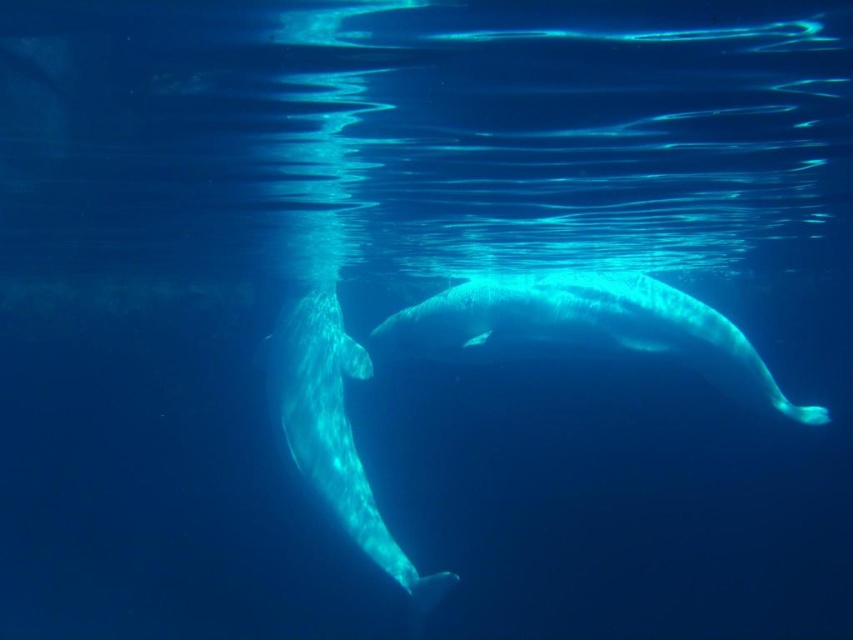
Question: Does translucent blue whale at center have a smaller size compared to translucent blue dolphin at center?

Choices:
 (A) no
 (B) yes

Answer: (B)

Question: Is translucent blue whale at center positioned in front of translucent blue dolphin at center?

Choices:
 (A) yes
 (B) no

Answer: (B)

Question: Among these points, which one is farthest from the camera?

Choices:
 (A) (322, 419)
 (B) (660, 355)

Answer: (A)

Question: Which object appears farthest from the camera in this image?

Choices:
 (A) translucent blue whale at center
 (B) translucent blue dolphin at center

Answer: (A)

Question: Does translucent blue whale at center appear on the right side of translucent blue dolphin at center?

Choices:
 (A) no
 (B) yes

Answer: (B)